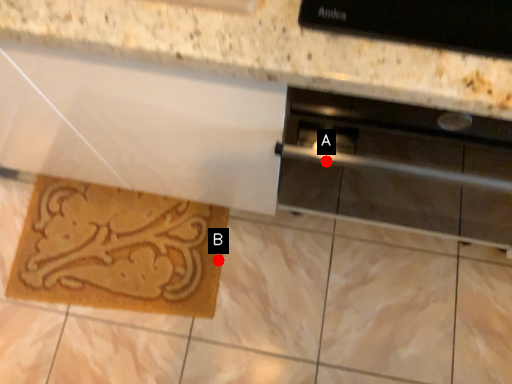
Question: Two points are circled on the image, labeled by A and B beside each circle. Which point appears closest to the camera in this image?

Choices:
 (A) A is closer
 (B) B is closer

Answer: (A)